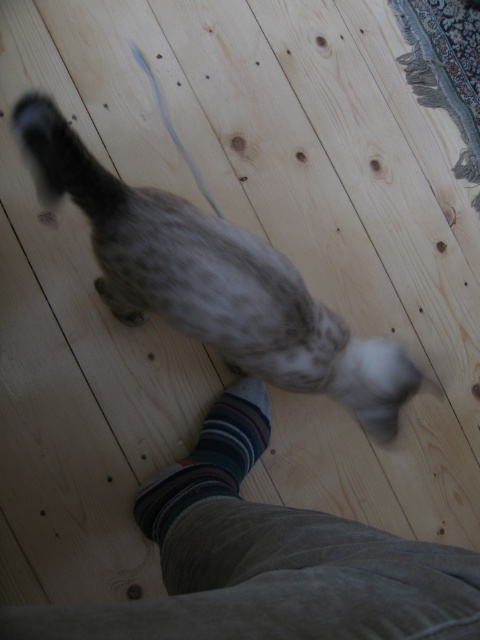
Question: Is striped sock at lower center thinner than spotted fur cat at center?

Choices:
 (A) yes
 (B) no

Answer: (A)

Question: Is striped cotton sock at lower center below white soft fur paw at lower center?

Choices:
 (A) yes
 (B) no

Answer: (A)

Question: Which point is closer to the camera?

Choices:
 (A) white soft fur paw at lower center
 (B) striped sock at lower center

Answer: (B)

Question: Which of these objects is positioned closest to the spotted fur cat at center?

Choices:
 (A) striped sock at lower center
 (B) white soft fur paw at lower center
 (C) fluffy gray tail at lower left
 (D) striped cotton sock at lower center

Answer: (B)

Question: Which object appears closest to the camera in this image?

Choices:
 (A) striped cotton sock at lower center
 (B) fluffy gray tail at lower left
 (C) white soft fur paw at lower center

Answer: (B)

Question: Considering the relative positions of striped sock at lower center and striped cotton sock at lower center in the image provided, where is striped sock at lower center located with respect to striped cotton sock at lower center?

Choices:
 (A) left
 (B) right

Answer: (B)